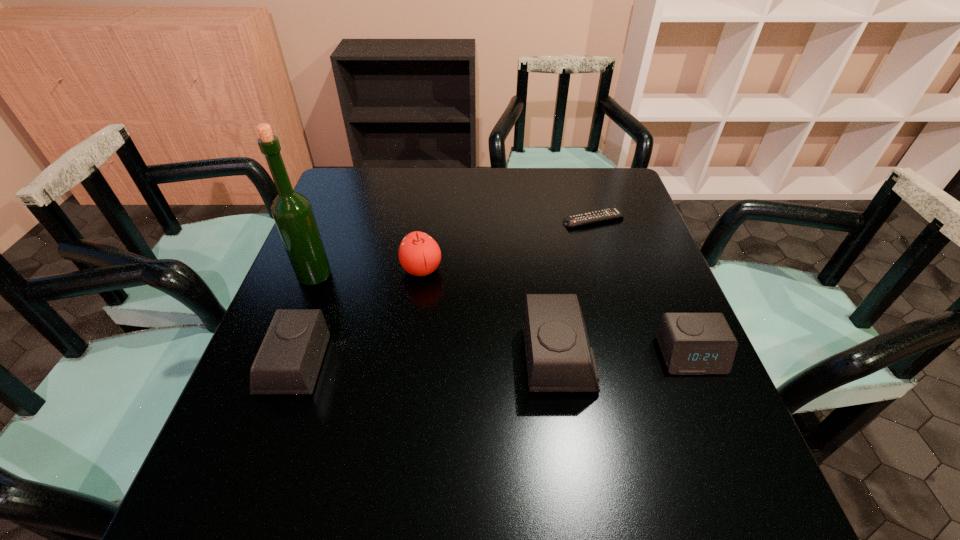
In order to click on vacant space at the far left corner of the desktop in this screenshot , I will do `click(372, 197)`.

This screenshot has height=540, width=960. In order to click on vacant space at the far right corner of the desktop in this screenshot , I will do `click(604, 188)`.

In order to click on vacant area at the near right corner in this screenshot , I will do [721, 438].

You are a GUI agent. You are given a task and a screenshot of the screen. Output one action in this format:
    pyautogui.click(x=<x>, y=<y>)
    Task: Click on the vacant region between the leftmost alarm clock and the apple
    The height and width of the screenshot is (540, 960).
    Given the screenshot: What is the action you would take?
    pyautogui.click(x=357, y=318)

This screenshot has width=960, height=540. I want to click on vacant region between the shortest object and the apple, so click(x=508, y=245).

The width and height of the screenshot is (960, 540). Identify the location of free space between the third object from left to right and the fourth object from left to right. [x=491, y=314].

Identify the location of vacant area that lies between the fifth tallest object and the tallest object. Image resolution: width=960 pixels, height=540 pixels. (502, 316).

Identify the location of empty space between the tallest object and the farthest object. (454, 248).

Locate an element on the screen. free spot between the third object from left to right and the remote control is located at coordinates (508, 245).

Locate an element on the screen. Image resolution: width=960 pixels, height=540 pixels. empty space between the remote control and the second alarm clock from left to right is located at coordinates (576, 289).